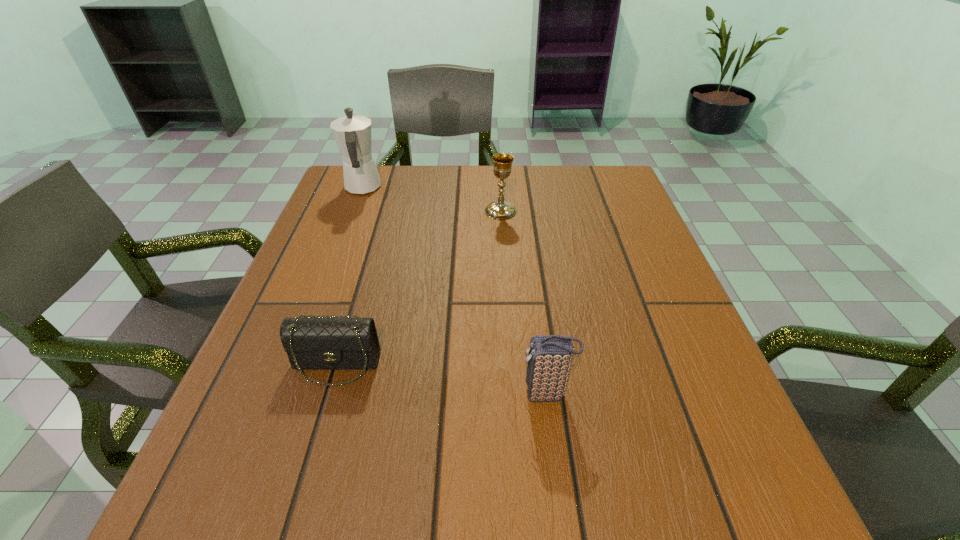
You are a GUI agent. You are given a task and a screenshot of the screen. Output one action in this format:
    pyautogui.click(x=<x>, y=<y>)
    Task: Click on the coffeepot
    This screenshot has height=540, width=960.
    Given the screenshot: What is the action you would take?
    tap(352, 133)

This screenshot has height=540, width=960. I want to click on chalice, so click(500, 210).

I want to click on the right clutch bag, so click(549, 361).

The width and height of the screenshot is (960, 540). Find the location of `the shortest object`. the shortest object is located at coordinates (320, 343).

At what (x,y) coordinates should I click in order to perform the action: click on the left clutch bag. Please return your answer as a coordinate pair (x, y). Looking at the image, I should click on (320, 343).

Find the location of a particular element. vacant space located on the front of the tallest object is located at coordinates (319, 302).

What are the coordinates of `free location located on the right of the chalice` in the screenshot? It's located at point(548,211).

Locate an element on the screen. vacant space located 0.140m with the zip open on the right clutch bag is located at coordinates (434, 394).

Locate an element on the screen. free region located 0.280m with the zip open on the right clutch bag is located at coordinates (347, 394).

Find the location of a particular element. free region located with the zip open on the right clutch bag is located at coordinates (284, 394).